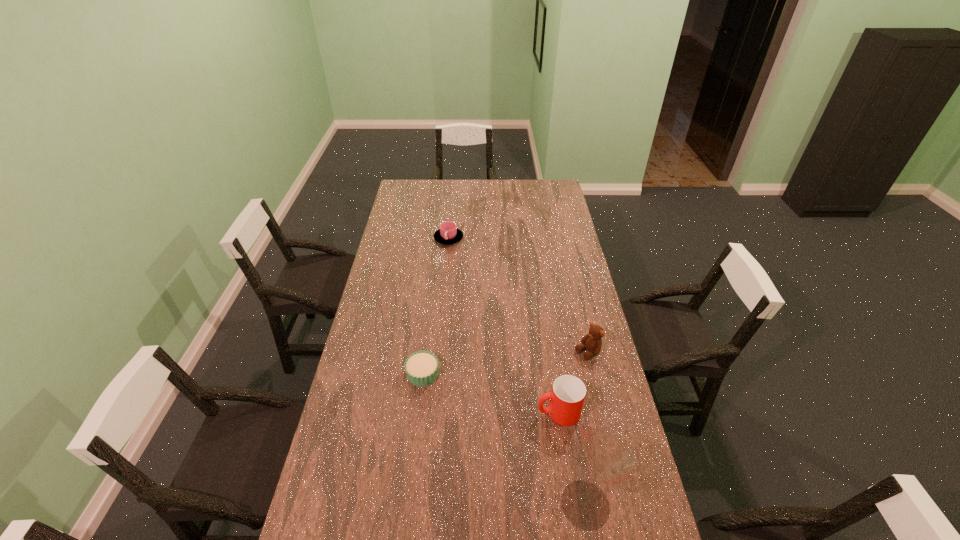
This screenshot has height=540, width=960. Identify the location of vacant space located 0.280m on the face of the teddy bear. (519, 397).

In order to click on blank area located on the face of the teddy bear in this screenshot , I will do `click(497, 410)`.

Image resolution: width=960 pixels, height=540 pixels. Find the location of `free space located 0.120m on the face of the teddy bear`. free space located 0.120m on the face of the teddy bear is located at coordinates (554, 374).

Where is `free space located 0.340m on the side of the nearer cup with the handle`? The image size is (960, 540). free space located 0.340m on the side of the nearer cup with the handle is located at coordinates (432, 428).

Locate an element on the screen. The image size is (960, 540). blank space located on the side of the nearer cup with the handle is located at coordinates (447, 426).

Locate an element on the screen. The height and width of the screenshot is (540, 960). free space located 0.400m on the side of the nearer cup with the handle is located at coordinates (413, 431).

Identify the location of free space located 0.210m on the side with the handle of the shorter cup. (455, 275).

You are a GUI agent. You are given a task and a screenshot of the screen. Output one action in this format:
    pyautogui.click(x=<x>, y=<y>)
    Task: Click on the blank space located on the side with the handle of the shorter cup
    This screenshot has height=540, width=960.
    Given the screenshot: What is the action you would take?
    pyautogui.click(x=459, y=295)

You are a GUI agent. You are given a task and a screenshot of the screen. Output one action in this format:
    pyautogui.click(x=<x>, y=<y>)
    Task: Click on the vacant space situated on the side with the handle of the shorter cup
    The image size is (960, 540).
    Given the screenshot: What is the action you would take?
    pyautogui.click(x=461, y=303)

This screenshot has width=960, height=540. In order to click on object positioned at the near edge in this screenshot , I will do `click(603, 460)`.